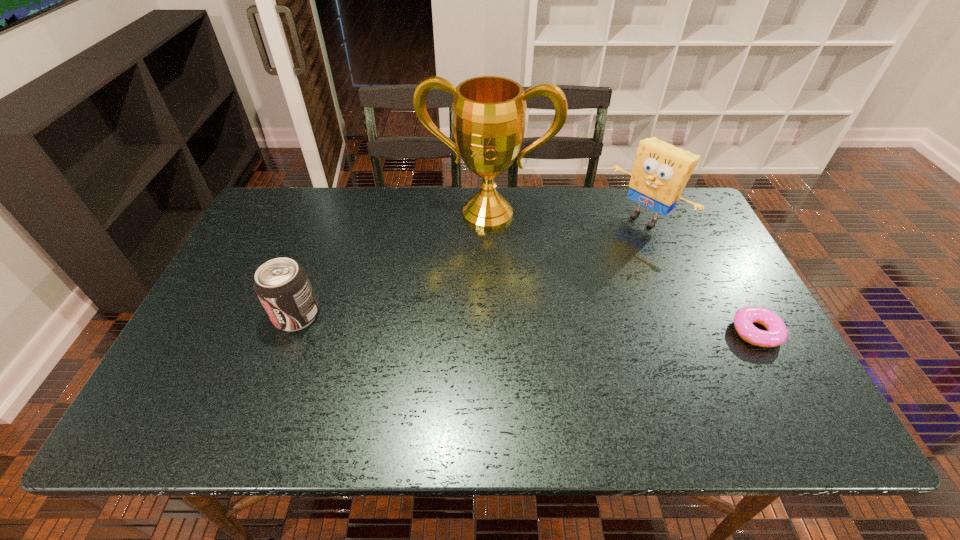
You are a GUI agent. You are given a task and a screenshot of the screen. Output one action in this format:
    pyautogui.click(x=<x>, y=<y>)
    Task: Click on the leftmost object
    
    Given the screenshot: What is the action you would take?
    pyautogui.click(x=282, y=286)

At what (x,y) coordinates should I click in order to perform the action: click on the second shortest object. Please return your answer as a coordinate pair (x, y). Looking at the image, I should click on (282, 286).

The height and width of the screenshot is (540, 960). I want to click on the shortest object, so click(777, 333).

This screenshot has width=960, height=540. What are the coordinates of `the tallest object` in the screenshot? It's located at (489, 111).

Image resolution: width=960 pixels, height=540 pixels. Identify the location of award. (489, 111).

At what (x,y) coordinates should I click in order to perform the action: click on sponge. Please return your answer as a coordinate pair (x, y). The image size is (960, 540). Looking at the image, I should click on (661, 171).

Find the location of `free location located 0.310m on the right of the soda can`. free location located 0.310m on the right of the soda can is located at coordinates (442, 315).

Where is `free space located on the left of the shortest object`? The width and height of the screenshot is (960, 540). free space located on the left of the shortest object is located at coordinates (613, 332).

Image resolution: width=960 pixels, height=540 pixels. I want to click on vacant space located 0.320m on the front-facing side of the third object from right to left, so click(x=457, y=314).

Image resolution: width=960 pixels, height=540 pixels. What are the coordinates of `blank space located 0.080m on the front-facing side of the third object from right to left` in the screenshot? It's located at (473, 251).